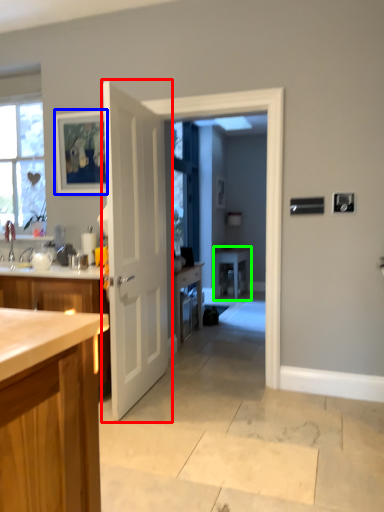
Question: Which is nearer to the door (highlighted by a red box)? picture frame (highlighted by a blue box) or table (highlighted by a green box).

Choices:
 (A) picture frame
 (B) table

Answer: (A)